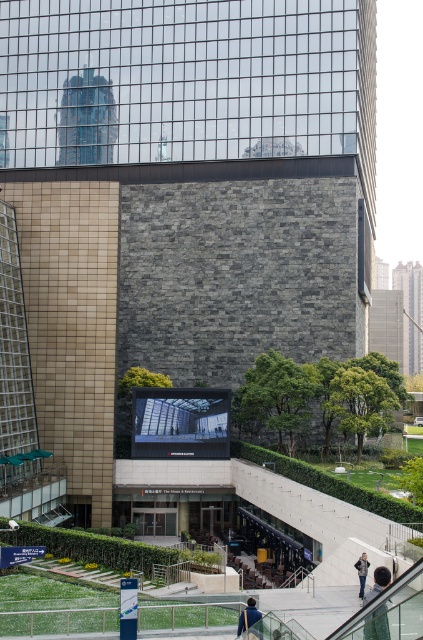
Question: Based on their relative distances, which object is nearer to the blue fabric jacket at lower center?

Choices:
 (A) dark brown hair at lower right
 (B) denim jacket at lower center

Answer: (A)

Question: Can you confirm if dark brown hair at lower right is positioned above blue fabric jacket at lower center?

Choices:
 (A) no
 (B) yes

Answer: (B)

Question: Does dark brown hair at lower right appear under denim jacket at lower center?

Choices:
 (A) no
 (B) yes

Answer: (A)

Question: Which point appears farthest from the camera in this image?

Choices:
 (A) (381, 611)
 (B) (260, 618)
 (C) (364, 572)

Answer: (C)

Question: Does dark brown hair at lower right have a smaller size compared to denim jacket at lower center?

Choices:
 (A) yes
 (B) no

Answer: (B)

Question: Estimate the real-world distances between objects in this image. Which object is closer to the denim jacket at lower center?

Choices:
 (A) blue fabric jacket at lower center
 (B) dark brown hair at lower right

Answer: (B)